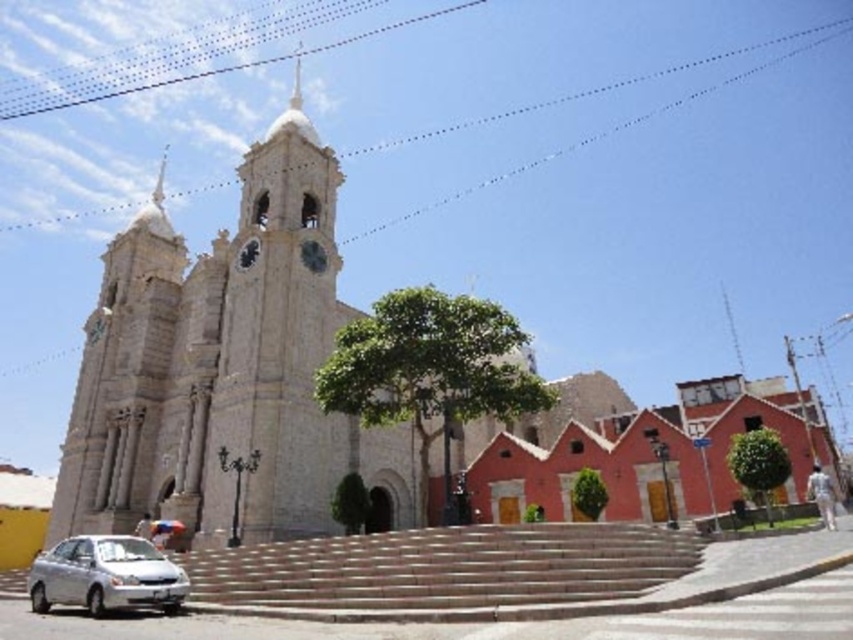
Can you confirm if smooth stone stairs at center is positioned to the right of silver metallic car at lower left?

Correct, you'll find smooth stone stairs at center to the right of silver metallic car at lower left.

Based on the photo, is smooth stone stairs at center wider than silver metallic car at lower left?

Indeed, smooth stone stairs at center has a greater width compared to silver metallic car at lower left.

Identify the location of smooth stone stairs at center. [445, 572].